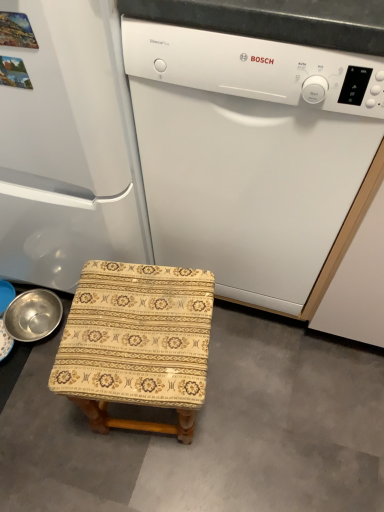
Question: Is beige fabric stool at lower left at the right side of white matte refrigerator at left?

Choices:
 (A) yes
 (B) no

Answer: (A)

Question: Is beige fabric stool at lower left facing away from white matte refrigerator at left?

Choices:
 (A) no
 (B) yes

Answer: (A)

Question: Considering the relative sizes of beige fabric stool at lower left and white matte refrigerator at left in the image provided, is beige fabric stool at lower left thinner than white matte refrigerator at left?

Choices:
 (A) yes
 (B) no

Answer: (B)

Question: Would you say beige fabric stool at lower left contains white matte refrigerator at left?

Choices:
 (A) yes
 (B) no

Answer: (B)

Question: Considering the relative positions of beige fabric stool at lower left and white matte refrigerator at left in the image provided, is beige fabric stool at lower left to the left of white matte refrigerator at left from the viewer's perspective?

Choices:
 (A) no
 (B) yes

Answer: (A)

Question: From a real-world perspective, is beige fabric stool at lower left below white matte refrigerator at left?

Choices:
 (A) no
 (B) yes

Answer: (B)

Question: Considering the relative sizes of white matte dishwasher at center and patterned fabric stool at center in the image provided, is white matte dishwasher at center bigger than patterned fabric stool at center?

Choices:
 (A) no
 (B) yes

Answer: (B)

Question: Are white matte dishwasher at center and patterned fabric stool at center making contact?

Choices:
 (A) yes
 (B) no

Answer: (B)

Question: Is white matte dishwasher at center to the right of patterned fabric stool at center from the viewer's perspective?

Choices:
 (A) yes
 (B) no

Answer: (A)

Question: Is white matte dishwasher at center facing towards patterned fabric stool at center?

Choices:
 (A) yes
 (B) no

Answer: (A)

Question: From the image's perspective, is white matte dishwasher at center above patterned fabric stool at center?

Choices:
 (A) yes
 (B) no

Answer: (A)

Question: Does white matte dishwasher at center have a lesser height compared to patterned fabric stool at center?

Choices:
 (A) yes
 (B) no

Answer: (B)

Question: Is white matte dishwasher at center surrounded by patterned fabric stool at center?

Choices:
 (A) yes
 (B) no

Answer: (B)